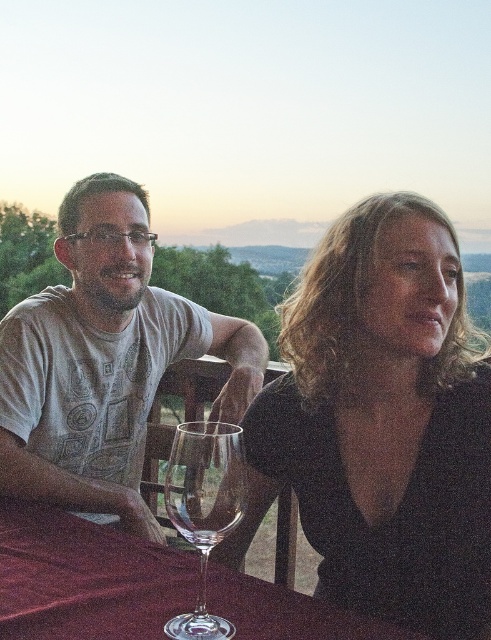
You are standing at the edge of the scene and want to place a small vase on the smooth glass table at center. Given that the point marking the table is located at coordinates (85, 579), can you determine if the vase will fit on the table?

The point marking the smooth glass table at center is at coordinates (85, 579). Since the coordinates indicate the table is present there, the vase can be placed on the smooth glass table at center.